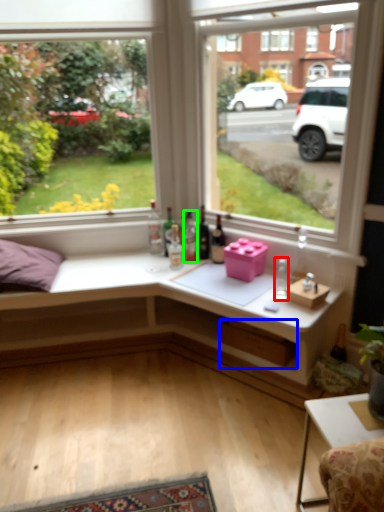
Question: Which is nearer to the bottle (highlighted by a red box)? window box (highlighted by a blue box) or bottle (highlighted by a green box).

Choices:
 (A) window box
 (B) bottle

Answer: (A)